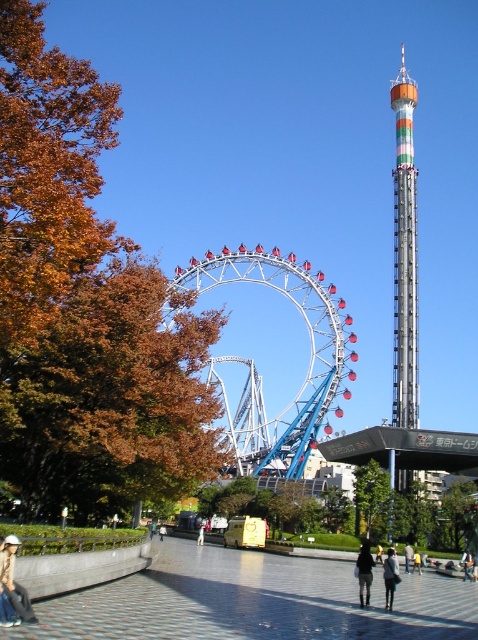
Question: Does light brown leather jacket at lower left appear over dark blue jeans at center?

Choices:
 (A) yes
 (B) no

Answer: (A)

Question: Does striped metal tower at upper right have a smaller size compared to dark blue jeans at center?

Choices:
 (A) no
 (B) yes

Answer: (A)

Question: Which point is farther from the camera taking this photo?

Choices:
 (A) (267, 280)
 (B) (370, 570)

Answer: (A)

Question: Which of the following is the closest to the observer?

Choices:
 (A) light brown leather jacket at lower left
 (B) light brown leather jacket at center
 (C) dark gray fabric jacket at center
 (D) metallic silver ferris wheel at center

Answer: (A)

Question: Estimate the real-world distances between objects in this image. Which object is closer to the light brown leather jacket at center?

Choices:
 (A) metallic silver ferris wheel at center
 (B) dark blue jeans at center
 (C) striped metal tower at upper right

Answer: (B)

Question: Is dark gray fabric jacket at center to the left of light brown leather jacket at center from the viewer's perspective?

Choices:
 (A) no
 (B) yes

Answer: (B)